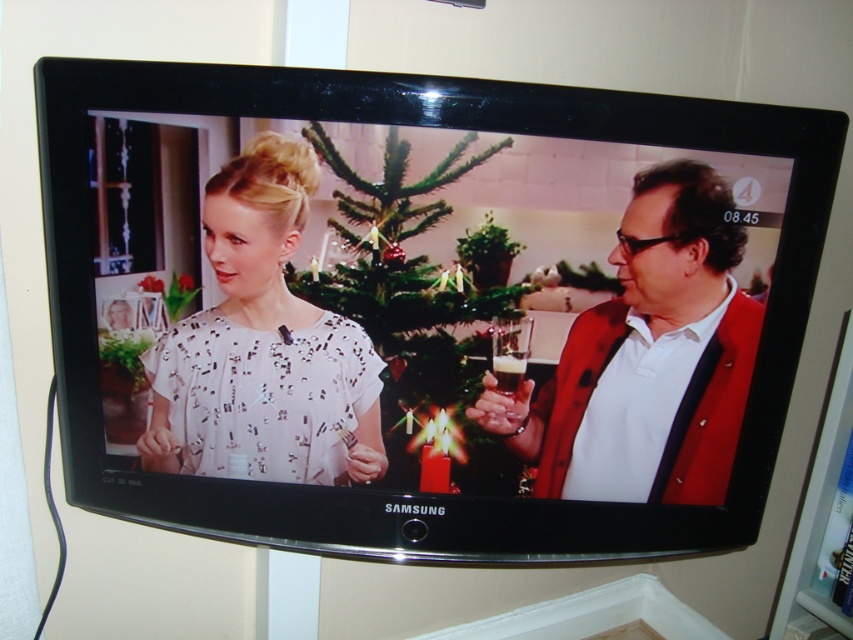
You are a costume designer reviewing the TV show scene. You need to determine which piece of clothing is closer to the camera. Which one is closer between the matte red blazer at right and the white sequined blouse at center?

The matte red blazer at right is closer to the camera than the white sequined blouse at center because it is further to the viewer.

You are a character on the TV show who needs to grab the translucent glass wine glass at right without touching the green matte christmas tree at center. Can you reach it directly from your current position?

The green matte christmas tree at center is in front of the translucent glass wine glass at right, so you can reach the translucent glass wine glass at right directly without moving the tree because it is behind the tree.

You are a costume designer reviewing the TV show scene. You need to determine which costume takes up more visual space in the scene. Which one is larger between the white sequined dress at center and the matte red blazer at right?

The white sequined dress at center is larger in size than the matte red blazer at right, so the white sequined dress at center takes up more visual space in the scene.